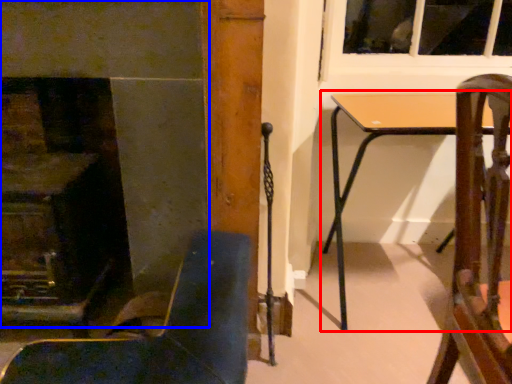
Question: Which object is closer to the camera taking this photo, table (highlighted by a red box) or fireplace (highlighted by a blue box)?

Choices:
 (A) table
 (B) fireplace

Answer: (B)